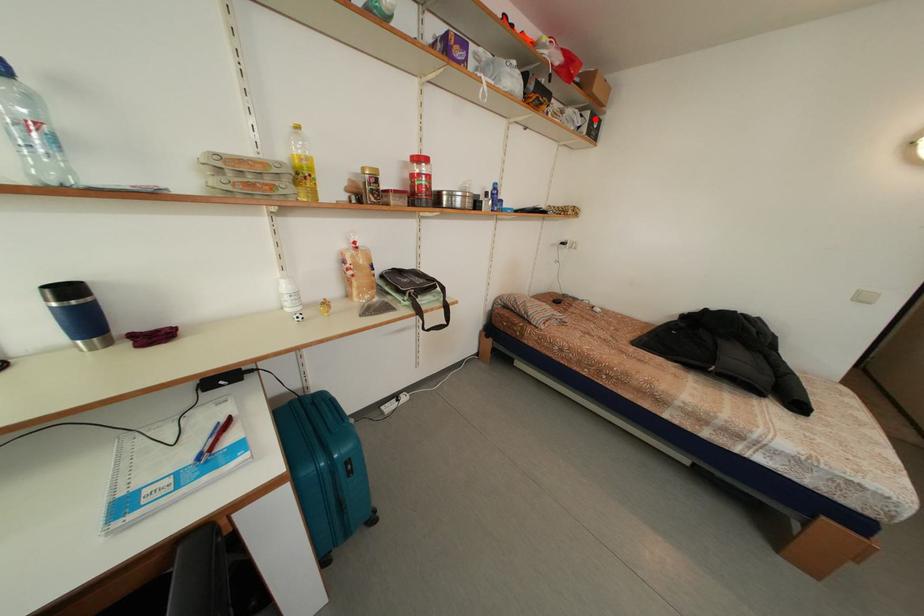
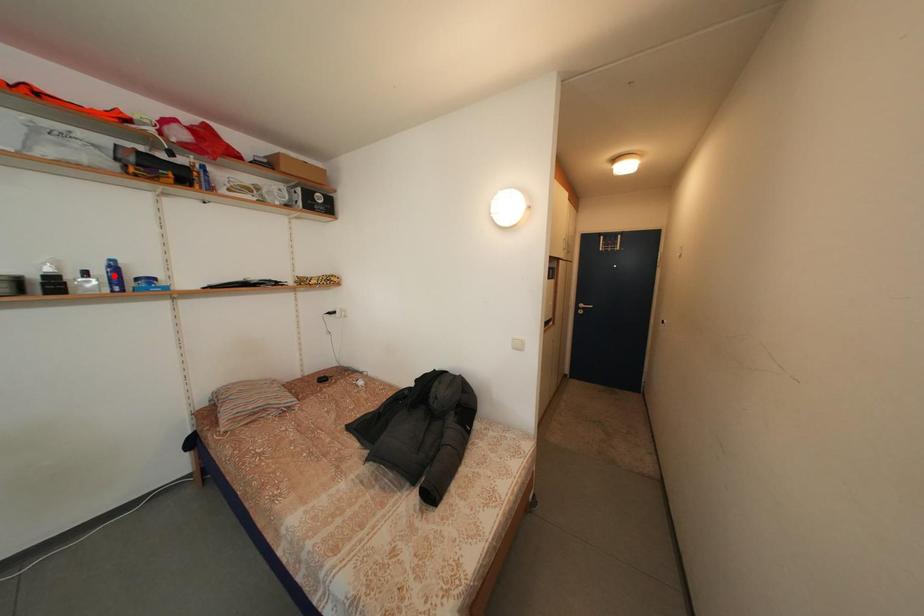
I am providing you with two images of the same scene from different viewpoints. A red point is marked on the first image and another point is marked on the second image. Is the marked point in image1 the same physical position as the marked point in image2?

No